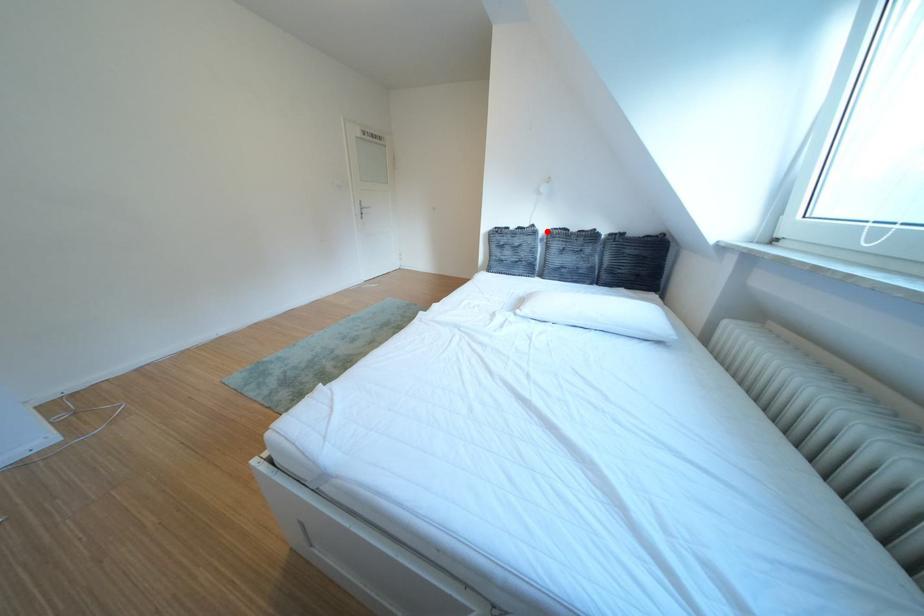
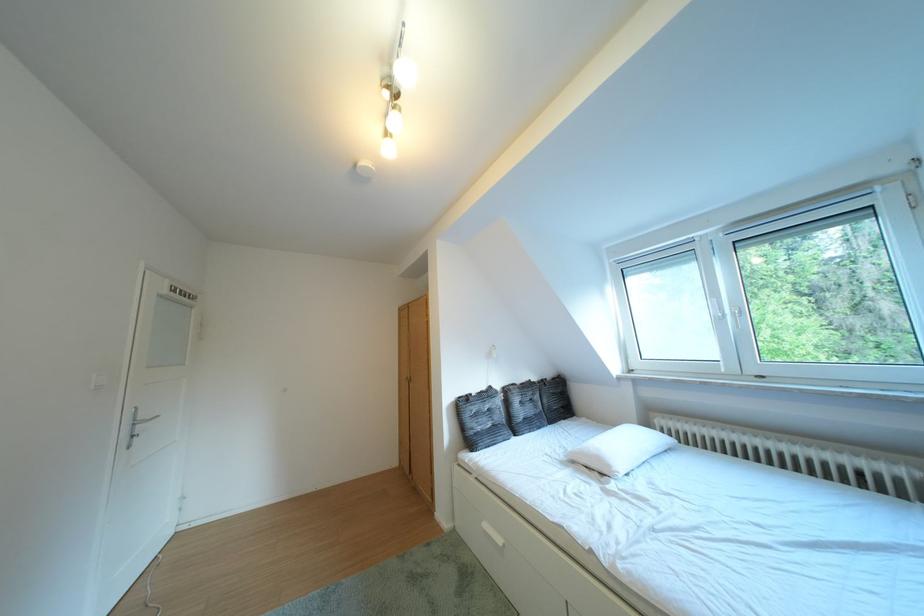
Question: I am providing you with two images of the same scene from different viewpoints. Given a red point in image1, look at the same physical point in image2. Is it:

Choices:
 (A) Closer to the viewpoint
 (B) Farther from the viewpoint

Answer: (B)